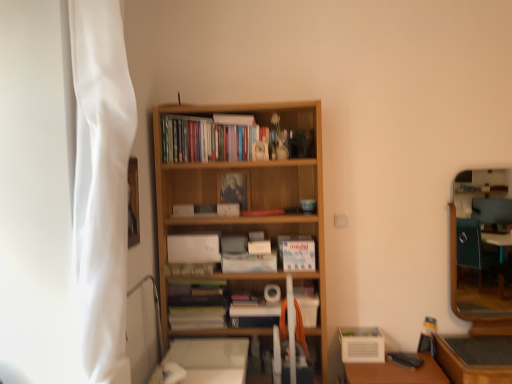
You are a GUI agent. You are given a task and a screenshot of the screen. Output one action in this format:
    pyautogui.click(x=<x>, y=<y>)
    Task: Click on the vacant point above blue matte paperback book at center, which is the second paperback book from top to bottom (from a real-world perspective)
    Image resolution: width=512 pixels, height=384 pixels.
    Given the screenshot: What is the action you would take?
    pyautogui.click(x=203, y=205)